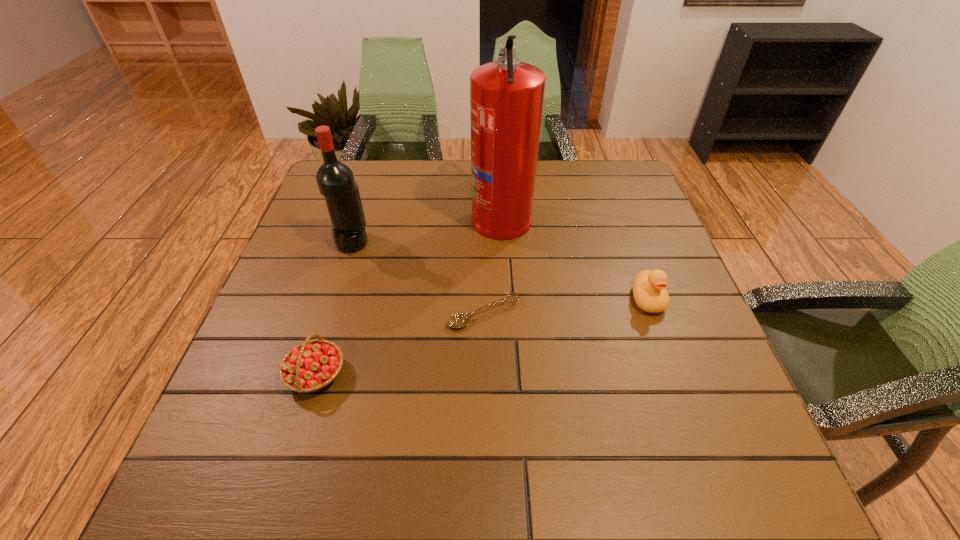
This screenshot has width=960, height=540. Find the location of `vacant space that's between the strawberry and the fire extinguisher`. vacant space that's between the strawberry and the fire extinguisher is located at coordinates (409, 296).

This screenshot has width=960, height=540. I want to click on object that stands as the closest to the strawberry, so click(x=459, y=320).

The width and height of the screenshot is (960, 540). What are the coordinates of `object that is the nearest to the shortest object` in the screenshot? It's located at (506, 96).

Find the location of a particular element. The width and height of the screenshot is (960, 540). free location that satisfies the following two spatial constraints: 1. on the front side of the second tallest object; 2. on the left side of the ladle is located at coordinates (330, 313).